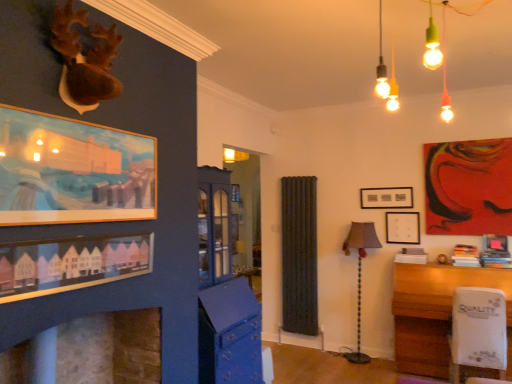
Question: Is point (386, 233) closer or farther from the camera than point (484, 332)?

Choices:
 (A) farther
 (B) closer

Answer: (A)

Question: Considering the relative positions of matte black picture frame at center, the 2th picture frame positioned from the back, and white plastic swivel chair at lower right in the image provided, is matte black picture frame at center, the 2th picture frame positioned from the back, to the left or to the right of white plastic swivel chair at lower right?

Choices:
 (A) left
 (B) right

Answer: (A)

Question: Which of these objects is positioned farthest from the white glossy table at lower right?

Choices:
 (A) matte pink picture frame at upper right, which is the first picture frame in right-to-left order
 (B) matte black picture frame at center, the first picture frame viewed from the back
 (C) wooden framed painting at upper left, placed as the fifth picture frame when sorted from right to left
 (D) matte wooden picture frame at lower left, acting as the 2th picture frame starting from the left
 (E) white plastic swivel chair at lower right

Answer: (C)

Question: Which is nearer to the matte black picture frame at center, acting as the fifth picture frame starting from the front?

Choices:
 (A) white glossy table at lower right
 (B) matte gray lampshade at center-right
 (C) white plastic swivel chair at lower right
 (D) stone fireplace at lower left
 (E) matte pink picture frame at upper right, which is the first picture frame in right-to-left order

Answer: (B)